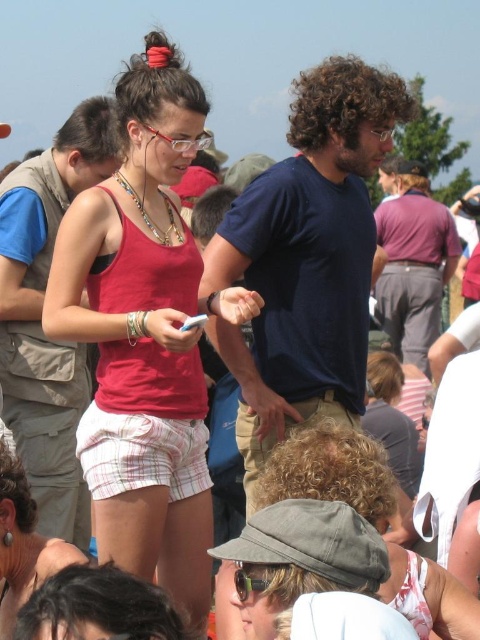
You are a photographer trying to capture a group photo of the matte red tank top at center and the matte pink shorts at center. The camera you have can only focus on objects within a 2.5 meter range. Will both items be in focus?

The matte red tank top at center and matte pink shorts at center are 2.72 meters apart from each other. Since the camera can only focus within 2.5 meters, the distance between them exceeds the focus range. Therefore, both items cannot be in focus simultaneously.

You are standing in the crowd at this event and want to locate the matte blue shirt at center and the gray fabric cap at center. From your perspective, which object is positioned to the left?

The matte blue shirt at center is positioned to the left of the gray fabric cap at center.